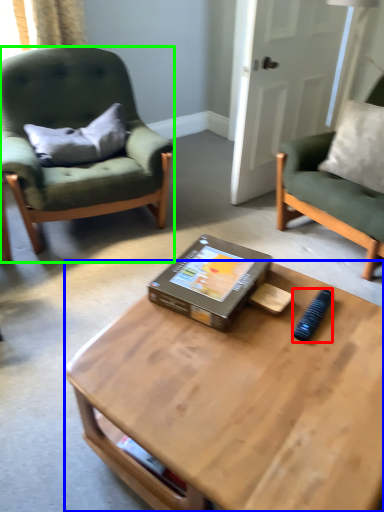
Question: Which is nearer to the remote control (highlighted by a red box)? coffee table (highlighted by a blue box) or chair (highlighted by a green box).

Choices:
 (A) coffee table
 (B) chair

Answer: (A)